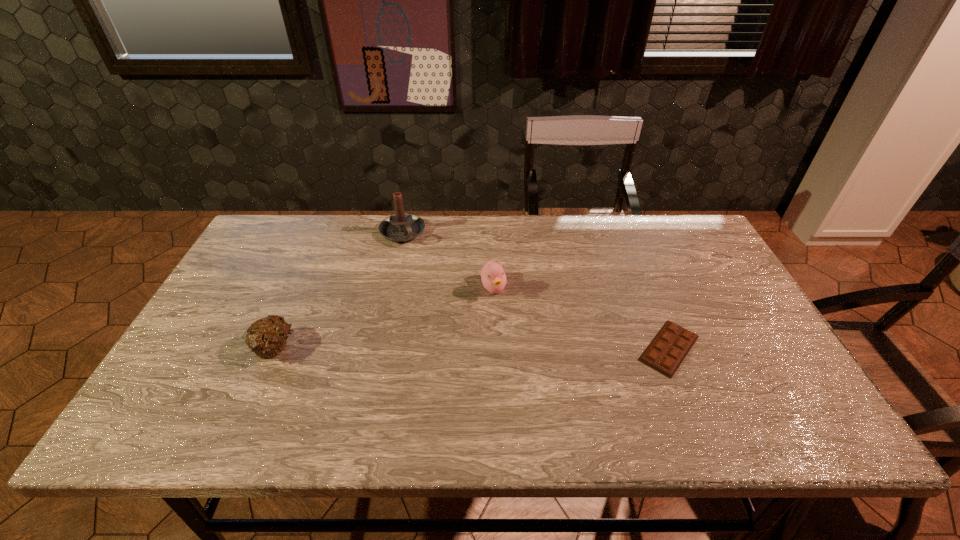
Locate an element on the screen. This screenshot has height=540, width=960. vacant point located 0.170m on the front-facing side of the second farthest object is located at coordinates (518, 348).

At what (x,y) coordinates should I click in order to perform the action: click on vacant space located on the front-facing side of the second farthest object. Please return your answer as a coordinate pair (x, y). Looking at the image, I should click on (509, 327).

Where is `blank space located 0.270m on the front-facing side of the second farthest object`? blank space located 0.270m on the front-facing side of the second farthest object is located at coordinates (533, 381).

This screenshot has height=540, width=960. In order to click on vacant space located 0.380m on the side of the farthest object with the handle loop in this screenshot , I will do `click(460, 327)`.

This screenshot has width=960, height=540. I want to click on free spot located on the side of the farthest object with the handle loop, so click(457, 322).

You are a GUI agent. You are given a task and a screenshot of the screen. Output one action in this format:
    pyautogui.click(x=<x>, y=<y>)
    Task: Click on the blank space located 0.080m on the side of the farthest object with the handle loop
    This screenshot has width=960, height=540.
    Given the screenshot: What is the action you would take?
    pyautogui.click(x=419, y=260)

Locate an element on the screen. Image resolution: width=960 pixels, height=540 pixels. object present at the far edge is located at coordinates point(400,227).

At what (x,y) coordinates should I click in order to perform the action: click on object located in the near edge section of the desktop. Please return your answer as a coordinate pair (x, y). Looking at the image, I should click on (665, 353).

The width and height of the screenshot is (960, 540). In order to click on object that is at the left edge in this screenshot , I will do `click(266, 338)`.

Find the location of a particular element. The height and width of the screenshot is (540, 960). vacant space at the far edge of the desktop is located at coordinates (546, 226).